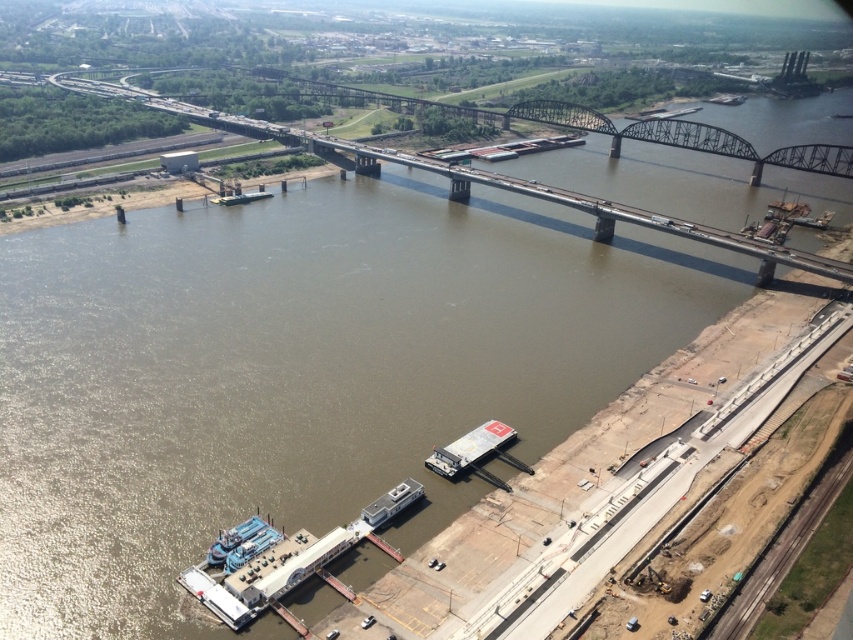
Is point (604, 131) positioned behind point (447, 474)?

Yes, point (604, 131) is farther from viewer.

Which is behind, point (567, 124) or point (503, 428)?

Point (567, 124)

Locate an element on the screen. This screenshot has height=640, width=853. metallic gray bridge at center is located at coordinates 688,138.